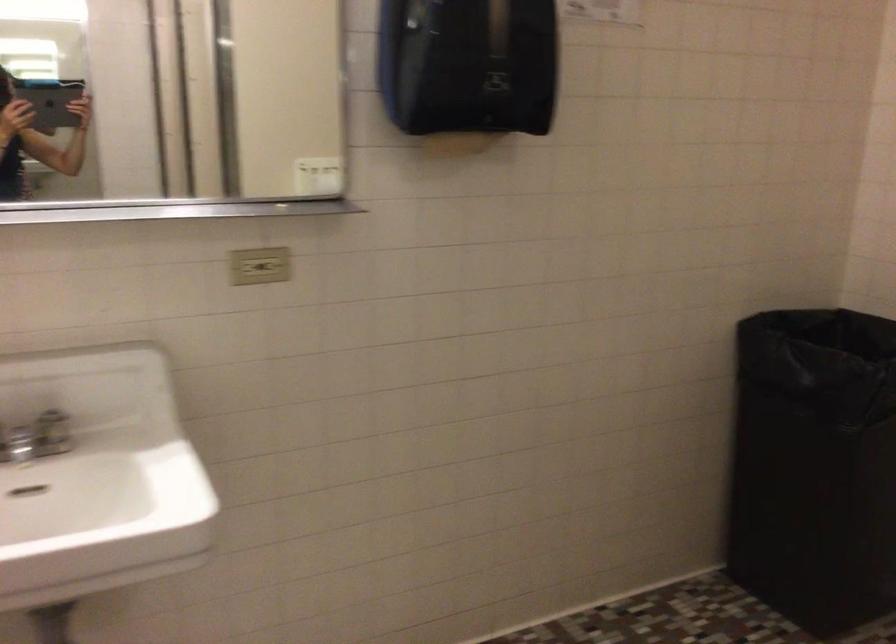
The width and height of the screenshot is (896, 644). Describe the element at coordinates (37, 438) in the screenshot. I see `the chrome faucet handle` at that location.